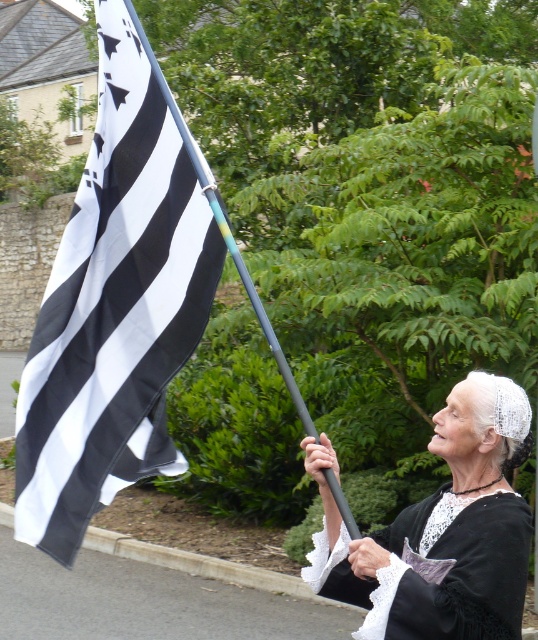
You are a photographer trying to capture the black and white striped flag at upper left and the black plastic pole at upper left in a single frame. Based on their sizes, which object should you position closer to the camera to ensure both fit in the frame?

The black and white striped flag at upper left is smaller than the black plastic pole at upper left. To ensure both fit in the frame, you should position the black plastic pole at upper left closer to the camera since it is larger and requires more space.

You are a photographer trying to capture a clear shot of the white lace dress at center and the black plastic pole at upper left. Since the flag is moving, you need to adjust your camera focus. Which object should you focus on first if you want to ensure the taller object is in focus?

The black plastic pole at upper left is taller than the white lace dress at center, so you should focus on the black plastic pole at upper left first to ensure it is in focus.